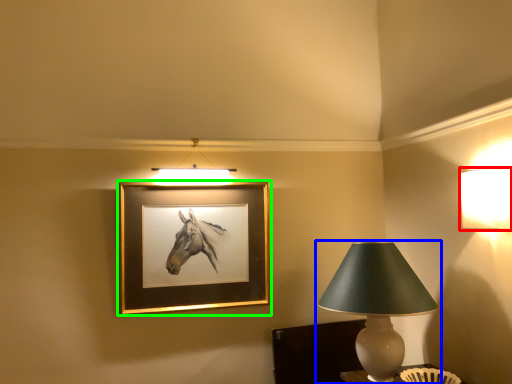
Question: Considering the real-world distances, which object is farthest from lamp (highlighted by a red box)? lamp (highlighted by a blue box) or picture frame (highlighted by a green box)?

Choices:
 (A) lamp
 (B) picture frame

Answer: (B)